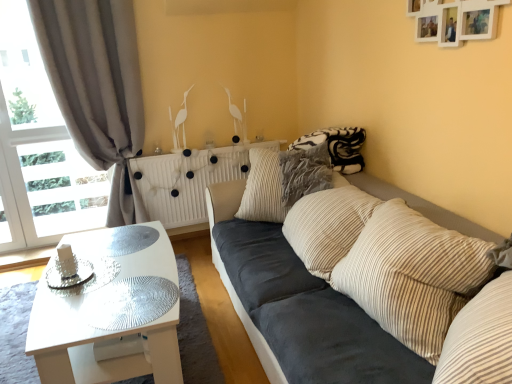
Question: From the image's perspective, relative to dark blue fabric couch at center, is white glossy coffee table at lower left above or below?

Choices:
 (A) below
 (B) above

Answer: (A)

Question: Considering the positions of white glossy coffee table at lower left and dark blue fabric couch at center in the image, is white glossy coffee table at lower left wider or thinner than dark blue fabric couch at center?

Choices:
 (A) thin
 (B) wide

Answer: (A)

Question: Estimate the real-world distances between objects in this image. Which object is farther from the transparent glass table at lower left?

Choices:
 (A) dark blue fabric couch at center
 (B) white textured radiator at center
 (C) striped corduroy pillow at center, marked as the first pillow in a front-to-back arrangement
 (D) white glossy coffee table at lower left
 (E) gray fabric curtain at left

Answer: (E)

Question: Considering the real-world distances, which object is closest to the transparent glass table at lower left?

Choices:
 (A) white glossy coffee table at lower left
 (B) striped corduroy pillow at center, which is the second pillow from back to front
 (C) dark blue fabric couch at center
 (D) striped corduroy pillow at center, which is the 2th pillow from front to back
 (E) gray fabric curtain at left

Answer: (A)